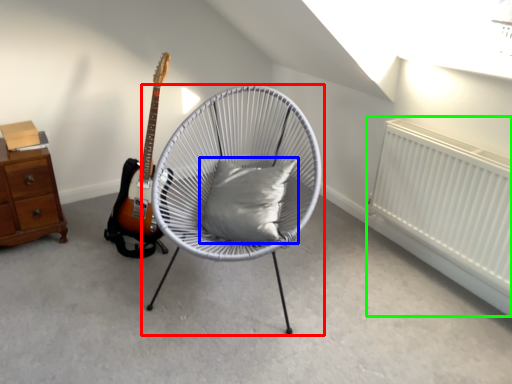
Question: Considering the real-world distances, which object is farthest from chair (highlighted by a red box)? pillow (highlighted by a blue box) or radiator (highlighted by a green box)?

Choices:
 (A) pillow
 (B) radiator

Answer: (B)